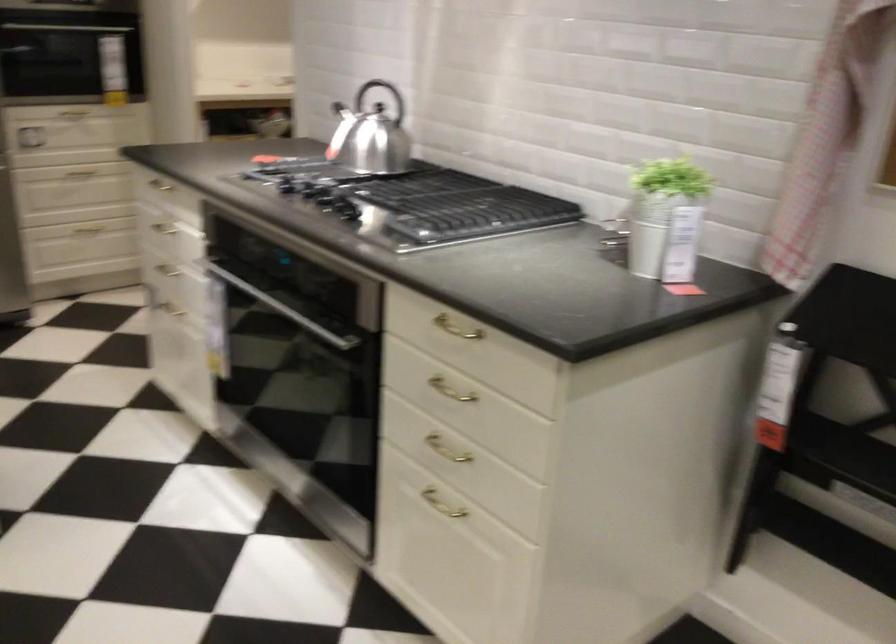
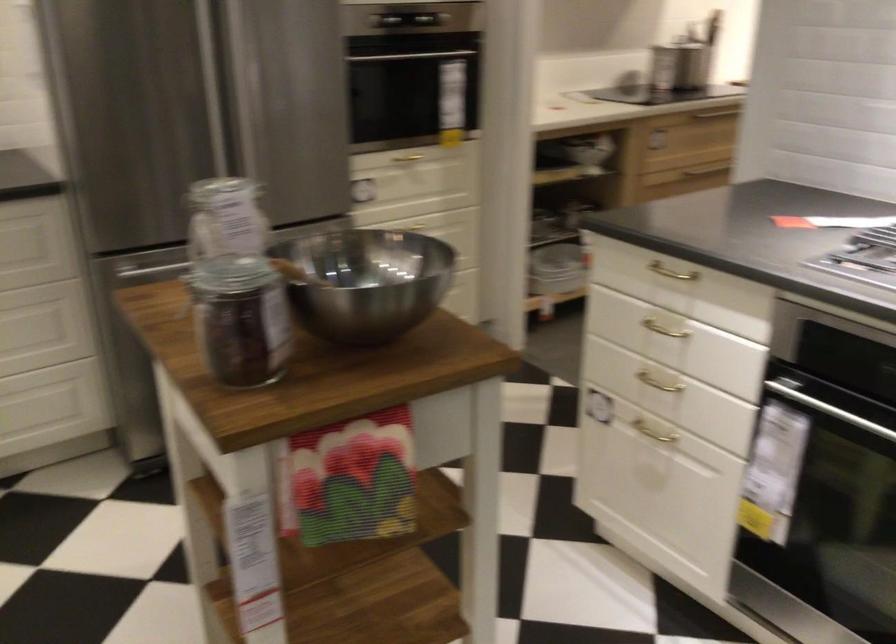
The point at (x=177, y=308) is marked in the first image. Where is the corresponding point in the second image?

(655, 431)